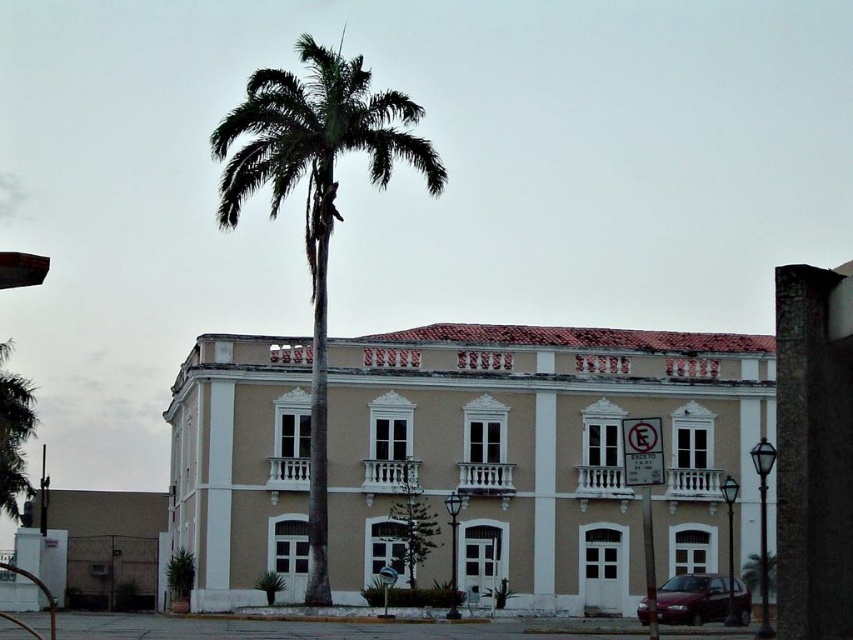
You are standing in front of the beige stucco building at center and the green leafy palm tree at center. Which object is closer to the ground?

The beige stucco building at center is closer to the ground because it is located below the green leafy palm tree at center.